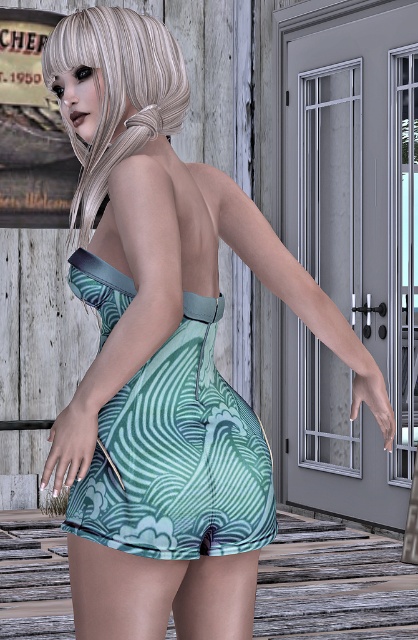
Question: Is green printed fabric dress at center in front of blondehair at upper left?

Choices:
 (A) yes
 (B) no

Answer: (A)

Question: Which of the following is the farthest from the observer?

Choices:
 (A) (224, 419)
 (B) (135, 116)

Answer: (B)

Question: Can you confirm if green printed fabric dress at center is bigger than blondehair at upper left?

Choices:
 (A) yes
 (B) no

Answer: (A)

Question: In this image, where is green printed fabric dress at center located relative to blondehair at upper left?

Choices:
 (A) below
 (B) above

Answer: (A)

Question: Which point is closer to the camera?

Choices:
 (A) click(x=86, y=536)
 (B) click(x=170, y=108)

Answer: (A)